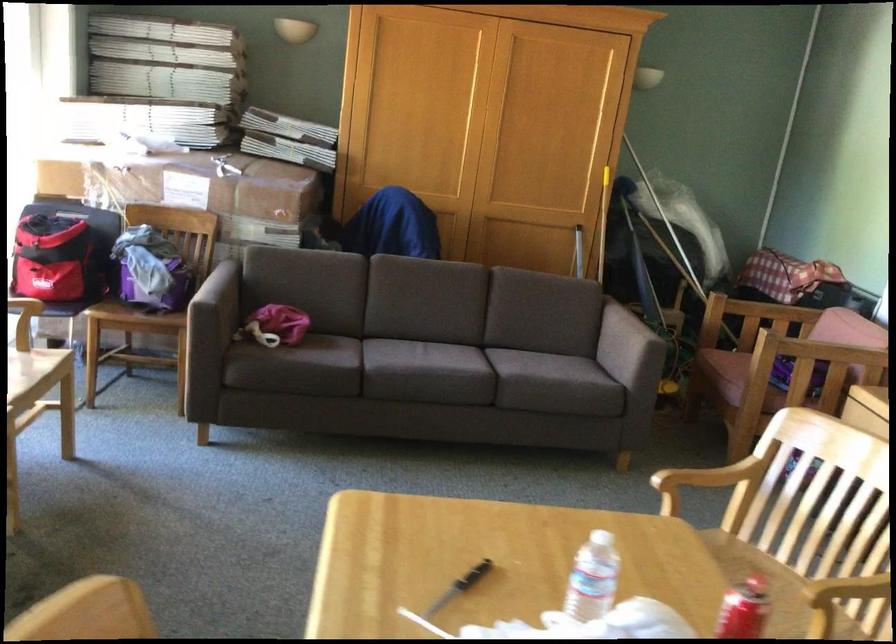
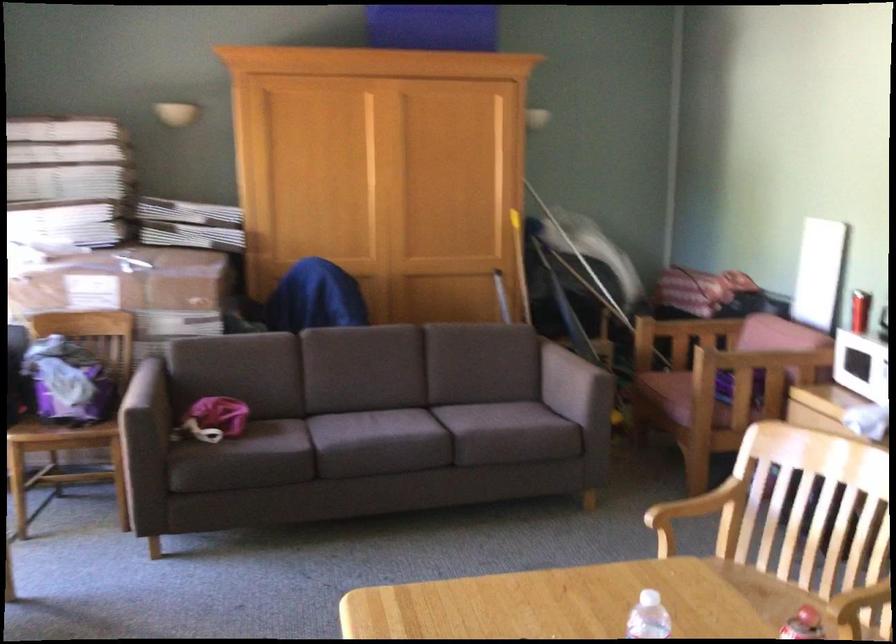
The point at (543, 541) is marked in the first image. Where is the corresponding point in the second image?

(555, 603)